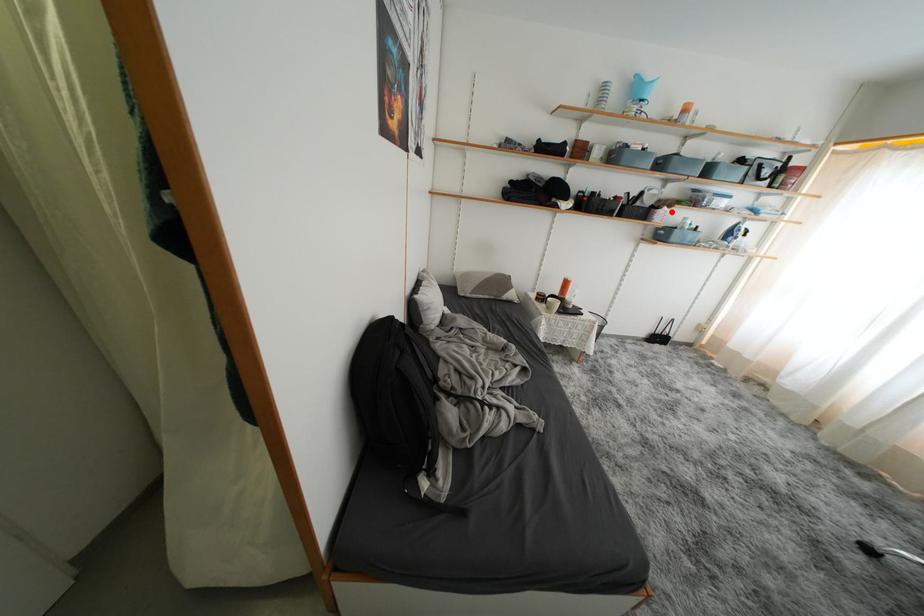
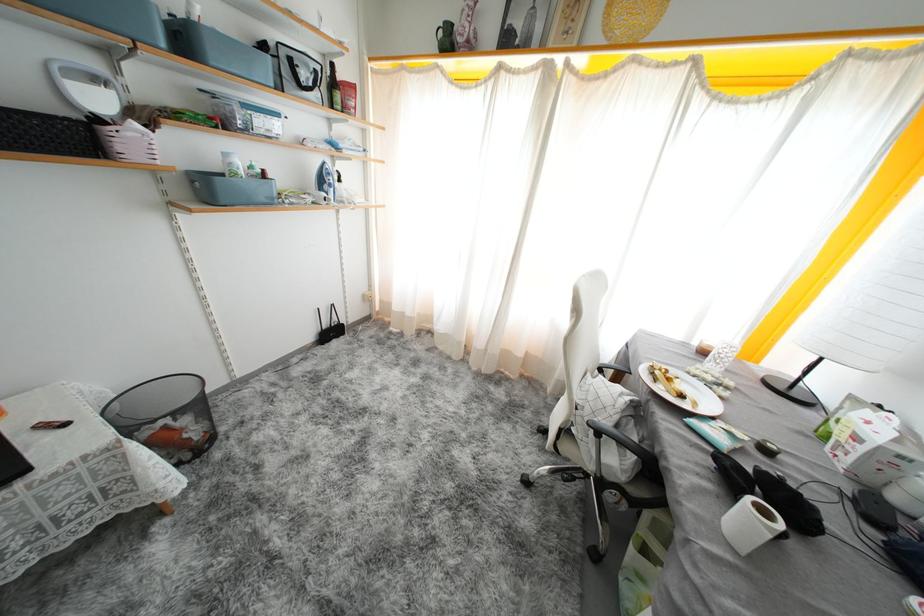
In the second image, find the point that corresponds to the highlighted location in the first image.

(141, 129)